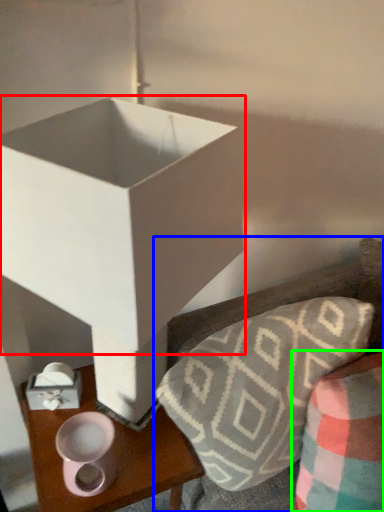
Question: Considering the real-world distances, which object is closest to box (highlighted by a red box)? furniture (highlighted by a blue box) or throw pillow (highlighted by a green box).

Choices:
 (A) furniture
 (B) throw pillow

Answer: (A)